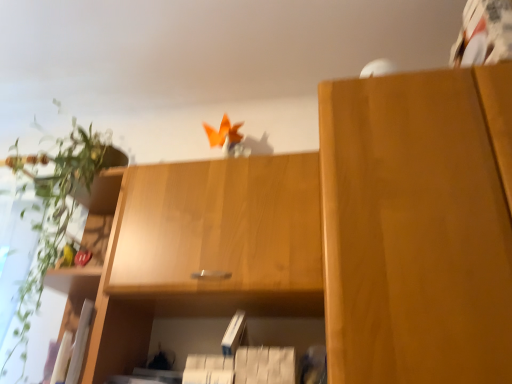
Describe the element at coordinates (56, 215) in the screenshot. I see `green leafy plant at left` at that location.

Describe the element at coordinates (204, 251) in the screenshot. I see `light brown wood cabinet at upper center, arranged as the second cabinetry when viewed from the right` at that location.

Locate an element on the screen. green leafy plant at left is located at coordinates (56, 215).

Considering the positions of objects matte wood cabinet at right, which ranks as the 2th cabinetry in left-to-right order, and green leafy plant at left in the image provided, who is more to the left, matte wood cabinet at right, which ranks as the 2th cabinetry in left-to-right order, or green leafy plant at left?

green leafy plant at left is more to the left.

What are the coordinates of `houseplant behind the matte wood cabinet at right, which ranks as the 2th cabinetry in left-to-right order` in the screenshot? It's located at (56, 215).

Is matte wood cabinet at right, which ranks as the 2th cabinetry in left-to-right order, thinner than green leafy plant at left?

In fact, matte wood cabinet at right, which ranks as the 2th cabinetry in left-to-right order, might be wider than green leafy plant at left.

Is the depth of matte wood cabinet at right, which ranks as the 2th cabinetry in left-to-right order, greater than that of green leafy plant at left?

No, it is in front of green leafy plant at left.

From the picture: Considering the relative positions of green leafy plant at left and light brown wood cabinet at upper center, arranged as the second cabinetry when viewed from the right, in the image provided, is green leafy plant at left to the left of light brown wood cabinet at upper center, arranged as the second cabinetry when viewed from the right, from the viewer's perspective?

Indeed, green leafy plant at left is positioned on the left side of light brown wood cabinet at upper center, arranged as the second cabinetry when viewed from the right.

Considering the points (44, 185) and (90, 376), which point is in front, point (44, 185) or point (90, 376)?

The point (90, 376) is closer.

Considering the relative sizes of green leafy plant at left and light brown wood cabinet at upper center, the 1th cabinetry from the left, in the image provided, is green leafy plant at left wider than light brown wood cabinet at upper center, the 1th cabinetry from the left,?

Correct, the width of green leafy plant at left exceeds that of light brown wood cabinet at upper center, the 1th cabinetry from the left.

From the picture: Does green leafy plant at left have a greater height compared to light brown wood cabinet at upper center, arranged as the second cabinetry when viewed from the right?

Indeed, green leafy plant at left has a greater height compared to light brown wood cabinet at upper center, arranged as the second cabinetry when viewed from the right.

Is light brown wood cabinet at upper center, the 1th cabinetry from the left, with matte wood cabinet at right, which ranks as the 2th cabinetry in left-to-right order?

No, light brown wood cabinet at upper center, the 1th cabinetry from the left, is not making contact with matte wood cabinet at right, which ranks as the 2th cabinetry in left-to-right order.

Is point (298, 199) closer to camera compared to point (361, 170)?

No, (298, 199) is further to viewer.

Does light brown wood cabinet at upper center, the 1th cabinetry from the left, have a larger size compared to matte wood cabinet at right, acting as the first cabinetry starting from the right?

Incorrect, light brown wood cabinet at upper center, the 1th cabinetry from the left, is not larger than matte wood cabinet at right, acting as the first cabinetry starting from the right.

Which of these two, light brown wood cabinet at upper center, the 1th cabinetry from the left, or matte wood cabinet at right, acting as the first cabinetry starting from the right, is thinner?

Thinner between the two is light brown wood cabinet at upper center, the 1th cabinetry from the left.

How distant is green leafy plant at left from white matte paperback book at center?

green leafy plant at left is 31.51 inches from white matte paperback book at center.

Is green leafy plant at left shorter than white matte paperback book at center?

Incorrect, the height of green leafy plant at left does not fall short of that of white matte paperback book at center.

Is green leafy plant at left directly adjacent to white matte paperback book at center?

No, green leafy plant at left is not in contact with white matte paperback book at center.

Does green leafy plant at left turn towards white matte paperback book at center?

No, green leafy plant at left is not aimed at white matte paperback book at center.

Is matte wood cabinet at right, acting as the first cabinetry starting from the right, at the back of white matte paperback book at center?

No, white matte paperback book at center is not facing away from matte wood cabinet at right, acting as the first cabinetry starting from the right.

Where is `the 2nd cabinetry in front when counting from the white matte paperback book at center`? the 2nd cabinetry in front when counting from the white matte paperback book at center is located at coordinates (418, 226).

Who is shorter, white matte paperback book at center or matte wood cabinet at right, acting as the first cabinetry starting from the right?

Standing shorter between the two is white matte paperback book at center.

Locate an element on the screen. This screenshot has width=512, height=384. houseplant on the left of matte wood cabinet at right, which ranks as the 2th cabinetry in left-to-right order is located at coordinates (56, 215).

From a real-world perspective, is green leafy plant at left on matte wood cabinet at right, which ranks as the 2th cabinetry in left-to-right order?

Yes, from a real-world perspective, green leafy plant at left is on top of matte wood cabinet at right, which ranks as the 2th cabinetry in left-to-right order.

Could you tell me if green leafy plant at left is turned towards matte wood cabinet at right, which ranks as the 2th cabinetry in left-to-right order?

No, green leafy plant at left is not turned towards matte wood cabinet at right, which ranks as the 2th cabinetry in left-to-right order.

Can you confirm if green leafy plant at left is wider than matte wood cabinet at right, which ranks as the 2th cabinetry in left-to-right order?

No.

Which object is further away from the camera, matte wood cabinet at right, which ranks as the 2th cabinetry in left-to-right order, or light brown wood cabinet at upper center, the 1th cabinetry from the left?

light brown wood cabinet at upper center, the 1th cabinetry from the left, is more distant.

Is point (322, 99) positioned after point (243, 186)?

No, (322, 99) is closer to viewer.

In the image, there is a light brown wood cabinet at upper center, arranged as the second cabinetry when viewed from the right. Identify the location of cabinetry above it (from the image's perspective). Image resolution: width=512 pixels, height=384 pixels. (418, 226).

Does matte wood cabinet at right, acting as the first cabinetry starting from the right, have a greater width compared to light brown wood cabinet at upper center, the 1th cabinetry from the left?

Indeed, matte wood cabinet at right, acting as the first cabinetry starting from the right, has a greater width compared to light brown wood cabinet at upper center, the 1th cabinetry from the left.

This screenshot has width=512, height=384. Identify the location of the 2nd cabinetry located beneath the green leafy plant at left (from a real-world perspective). (418, 226).

This screenshot has height=384, width=512. Find the location of `houseplant in front of the light brown wood cabinet at upper center, the 1th cabinetry from the left`. houseplant in front of the light brown wood cabinet at upper center, the 1th cabinetry from the left is located at coordinates (56, 215).

Based on their spatial positions, is light brown wood cabinet at upper center, arranged as the second cabinetry when viewed from the right, or matte wood cabinet at right, which ranks as the 2th cabinetry in left-to-right order, further from white matte paperback book at center?

Based on the image, matte wood cabinet at right, which ranks as the 2th cabinetry in left-to-right order, appears to be further to white matte paperback book at center.

Estimate the real-world distances between objects in this image. Which object is further from white matte paperback book at center, light brown wood cabinet at upper center, the 1th cabinetry from the left, or green leafy plant at left?

Among the two, green leafy plant at left is located further to white matte paperback book at center.

Estimate the real-world distances between objects in this image. Which object is further from light brown wood cabinet at upper center, arranged as the second cabinetry when viewed from the right, white matte paperback book at center or matte wood cabinet at right, which ranks as the 2th cabinetry in left-to-right order?

Among the two, matte wood cabinet at right, which ranks as the 2th cabinetry in left-to-right order, is located further to light brown wood cabinet at upper center, arranged as the second cabinetry when viewed from the right.

Based on their spatial positions, is white matte paperback book at center or green leafy plant at left further from light brown wood cabinet at upper center, the 1th cabinetry from the left?

Among the two, green leafy plant at left is located further to light brown wood cabinet at upper center, the 1th cabinetry from the left.

Looking at the image, which one is located further to white matte paperback book at center, green leafy plant at left or light brown wood cabinet at upper center, arranged as the second cabinetry when viewed from the right?

green leafy plant at left.

When comparing their distances from white matte paperback book at center, does matte wood cabinet at right, which ranks as the 2th cabinetry in left-to-right order, or green leafy plant at left seem further?

green leafy plant at left is positioned further to the anchor white matte paperback book at center.

Estimate the real-world distances between objects in this image. Which object is further from green leafy plant at left, matte wood cabinet at right, acting as the first cabinetry starting from the right, or white matte paperback book at center?

The object further to green leafy plant at left is matte wood cabinet at right, acting as the first cabinetry starting from the right.

Estimate the real-world distances between objects in this image. Which object is further from light brown wood cabinet at upper center, the 1th cabinetry from the left, matte wood cabinet at right, which ranks as the 2th cabinetry in left-to-right order, or white matte paperback book at center?

The object further to light brown wood cabinet at upper center, the 1th cabinetry from the left, is matte wood cabinet at right, which ranks as the 2th cabinetry in left-to-right order.

Identify the location of paperback book between green leafy plant at left and matte wood cabinet at right, acting as the first cabinetry starting from the right. This screenshot has width=512, height=384. (234, 333).

In order to click on cabinetry between green leafy plant at left and matte wood cabinet at right, acting as the first cabinetry starting from the right, from left to right in this screenshot , I will do `click(204, 251)`.

I want to click on cabinetry situated between green leafy plant at left and white matte paperback book at center from left to right, so click(204, 251).

This screenshot has width=512, height=384. Find the location of `paperback book between light brown wood cabinet at upper center, arranged as the second cabinetry when viewed from the right, and matte wood cabinet at right, acting as the first cabinetry starting from the right, from left to right`. paperback book between light brown wood cabinet at upper center, arranged as the second cabinetry when viewed from the right, and matte wood cabinet at right, acting as the first cabinetry starting from the right, from left to right is located at coordinates (234, 333).